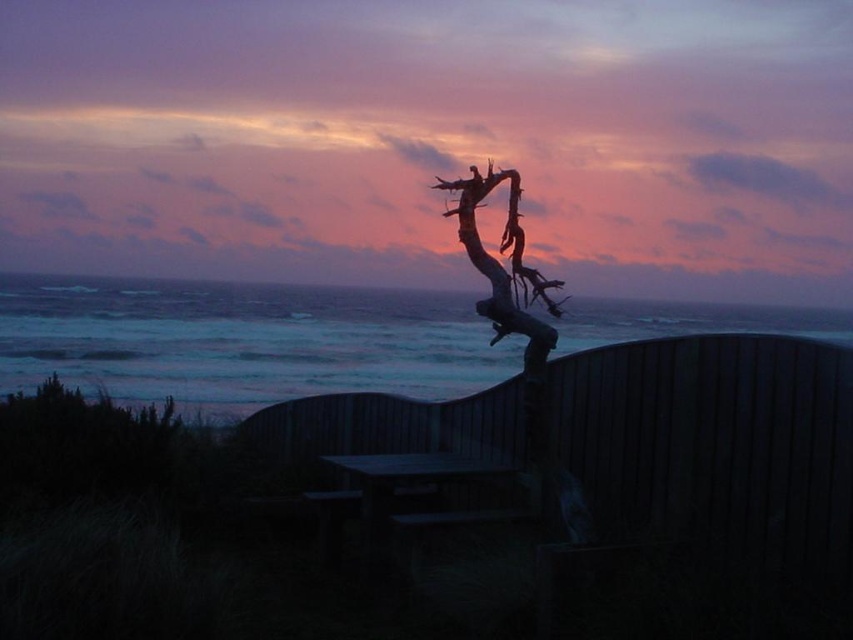
Question: Can you confirm if blue water at upper center is smaller than wooden driftwood at center?

Choices:
 (A) no
 (B) yes

Answer: (A)

Question: Which object appears closest to the camera in this image?

Choices:
 (A) wooden driftwood at center
 (B) blue water at upper center

Answer: (B)

Question: Can you confirm if blue water at upper center is positioned to the left of wooden driftwood at center?

Choices:
 (A) yes
 (B) no

Answer: (A)

Question: Does blue water at upper center appear on the right side of wooden driftwood at center?

Choices:
 (A) yes
 (B) no

Answer: (B)